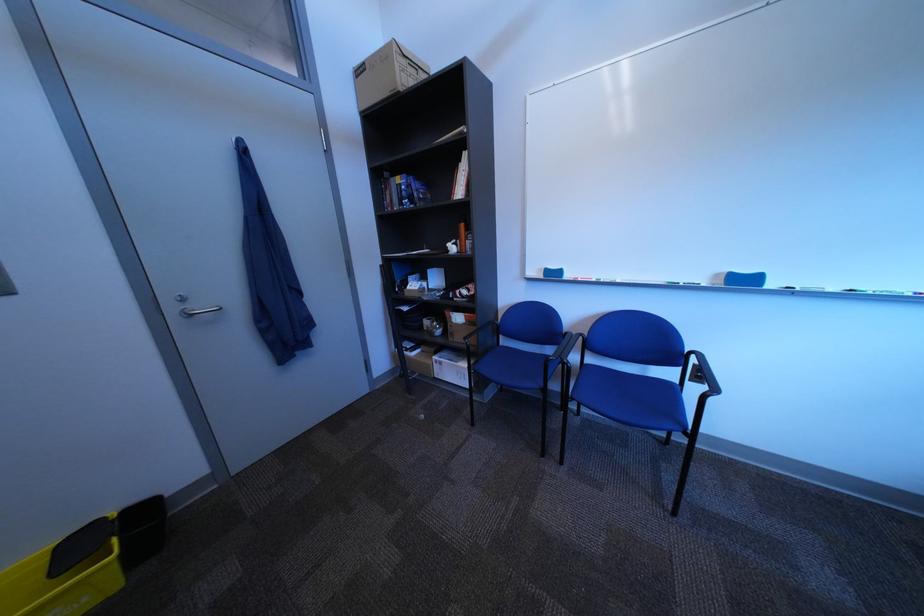
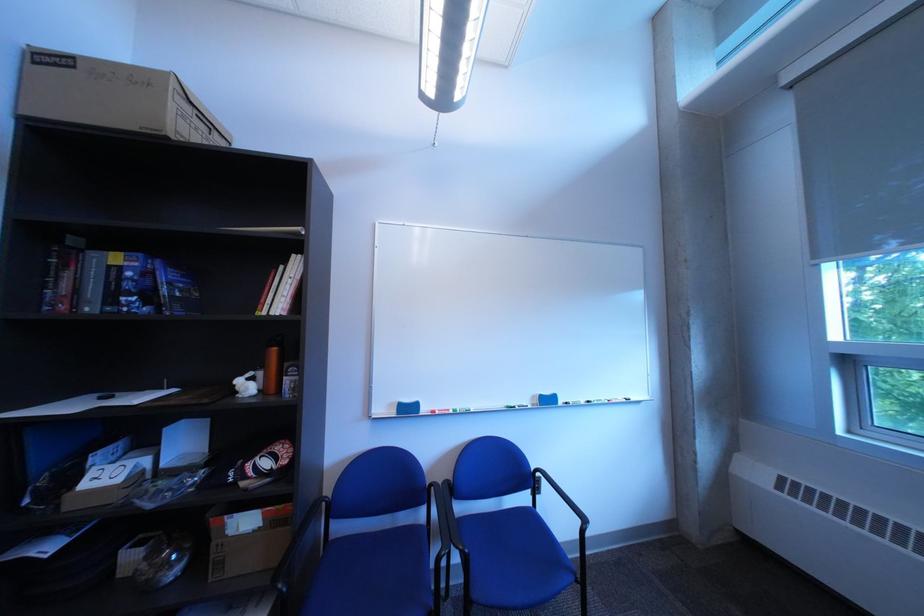
Find the pixel in the second image that matches [476,166] in the first image.

(297, 270)